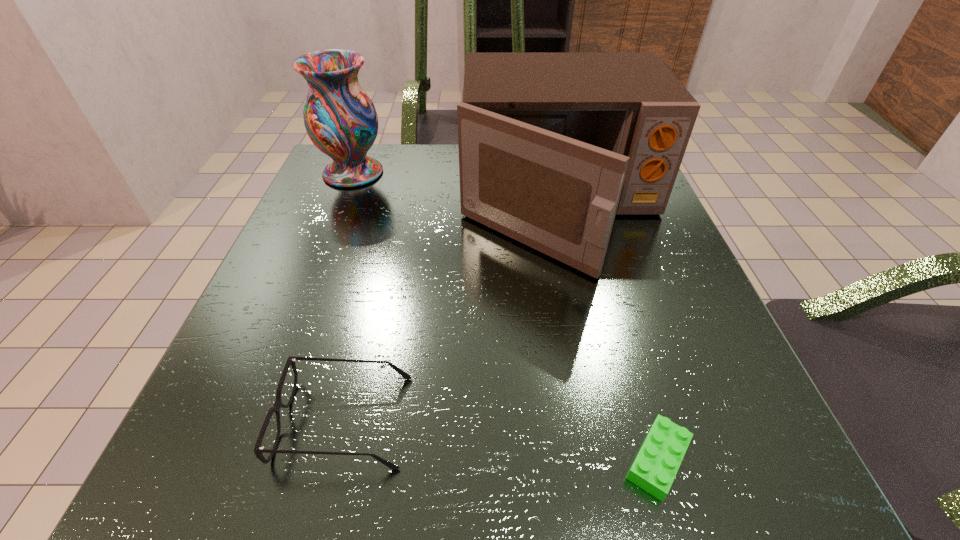
This screenshot has width=960, height=540. I want to click on free space at the near edge, so click(493, 428).

This screenshot has width=960, height=540. I want to click on vacant region at the left edge of the desktop, so click(352, 204).

I want to click on vacant area at the right edge of the desktop, so click(651, 276).

Image resolution: width=960 pixels, height=540 pixels. I want to click on free space at the near left corner, so click(311, 463).

This screenshot has height=540, width=960. What are the coordinates of `free space between the microwave oven and the Lego` in the screenshot? It's located at (609, 333).

Locate an element on the screen. The width and height of the screenshot is (960, 540). free point between the vase and the microwave oven is located at coordinates (x=456, y=190).

This screenshot has width=960, height=540. Identify the location of free spot between the microwave oven and the third tallest object. (452, 314).

Find the location of a particular element. Image resolution: width=960 pixels, height=540 pixels. empty space between the microwave oven and the shortest object is located at coordinates (609, 333).

Find the location of a particular element. The height and width of the screenshot is (540, 960). free spot between the vase and the shortest object is located at coordinates (505, 316).

Identify the location of free space between the shortest object and the second shortest object. (501, 440).